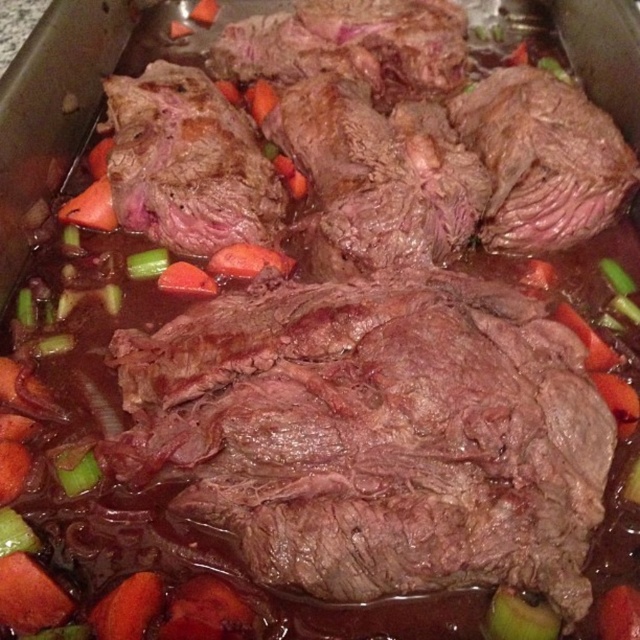
Is green translucent onion at lower left positioned in front of green translucent celery at center?

Yes, green translucent onion at lower left is in front of green translucent celery at center.

Which is above, green translucent onion at lower left or green translucent celery at center?

green translucent celery at center

Between point (65, 470) and point (161, 253), which one is positioned in front?

Positioned in front is point (65, 470).

Find the location of `green translucent onion at lower left`. green translucent onion at lower left is located at coordinates (77, 474).

Which is in front, point (252, 396) or point (632, 609)?

Point (632, 609) is in front.

Does brown matte steak at center have a lesser height compared to orange carrot at center?

In fact, brown matte steak at center may be taller than orange carrot at center.

Does point (131, 364) come closer to viewer compared to point (634, 605)?

No, it is not.

Identify the location of brown matte steak at center. This screenshot has width=640, height=640. (376, 435).

Between point (496, 604) and point (141, 253), which one is positioned behind?

Positioned behind is point (141, 253).

Who is more forward, (516, 598) or (141, 259)?

Point (516, 598) is in front.

Locate an element on the screen. green leafy vegetable at center is located at coordinates (518, 618).